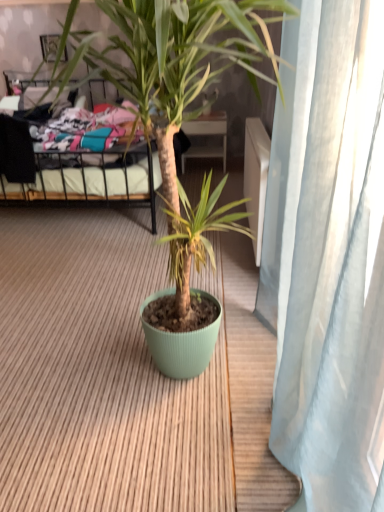
Locate an element on the screen. The width and height of the screenshot is (384, 512). vacant space to the left of matte green pot at center is located at coordinates (35, 322).